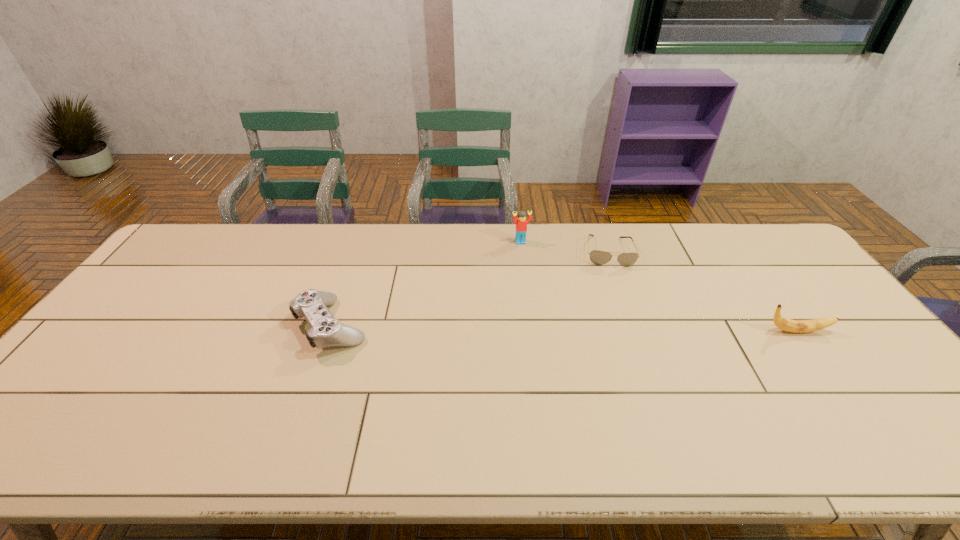
Identify the location of vacant space that's between the control and the Lego. This screenshot has height=540, width=960. (426, 284).

The width and height of the screenshot is (960, 540). In order to click on empty space that is in between the second tallest object and the control in this screenshot , I will do `click(564, 328)`.

Where is `free space that is in between the third object from left to right and the banana`? free space that is in between the third object from left to right and the banana is located at coordinates (702, 291).

Image resolution: width=960 pixels, height=540 pixels. I want to click on object that ranks as the closest to the banana, so click(597, 257).

This screenshot has width=960, height=540. What are the coordinates of `object that is the second closest to the tallest object` in the screenshot? It's located at (326, 330).

Where is `vacant area that satisfies the following two spatial constraints: 1. on the front side of the sunglasses; 2. on the right side of the tallest object`? vacant area that satisfies the following two spatial constraints: 1. on the front side of the sunglasses; 2. on the right side of the tallest object is located at coordinates (521, 252).

Locate an element on the screen. Image resolution: width=960 pixels, height=540 pixels. free space that satisfies the following two spatial constraints: 1. on the front side of the shortest object; 2. on the right side of the second object from left to right is located at coordinates (521, 252).

You are a GUI agent. You are given a task and a screenshot of the screen. Output one action in this format:
    pyautogui.click(x=<x>, y=<y>)
    Task: Click on the vacant space that satisfies the following two spatial constraints: 1. on the back side of the third tallest object; 2. on the right side of the third object from right to left
    
    Given the screenshot: What is the action you would take?
    pyautogui.click(x=361, y=242)